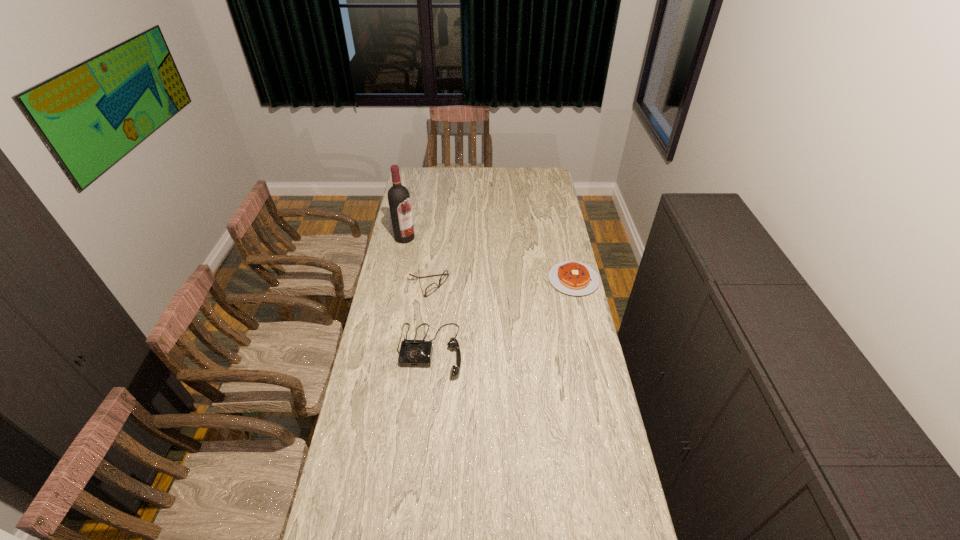
Locate an element on the screen. vacant space situated 0.380m on the front-facing side of the spectacles is located at coordinates (517, 328).

Find the location of a particular element. Image resolution: width=960 pixels, height=540 pixels. vacant position located on the label of the tallest object is located at coordinates pyautogui.click(x=439, y=271).

Find the location of a particular element. The width and height of the screenshot is (960, 540). free space located on the label of the tallest object is located at coordinates (440, 272).

Identify the location of blank area located 0.210m on the label of the tallest object. This screenshot has width=960, height=540. (432, 264).

Find the location of `telephone present at the left edge`. telephone present at the left edge is located at coordinates (413, 353).

Image resolution: width=960 pixels, height=540 pixels. Identify the location of spectacles at the left edge. (433, 287).

Locate an element on the screen. This screenshot has height=540, width=960. wine bottle situated at the left edge is located at coordinates (398, 195).

Where is `object that is at the right edge`? The image size is (960, 540). object that is at the right edge is located at coordinates (575, 278).

The height and width of the screenshot is (540, 960). I want to click on free region at the far edge of the desktop, so click(x=459, y=177).

In the image, there is a desktop. Where is `vacant space at the near edge`? vacant space at the near edge is located at coordinates (400, 529).